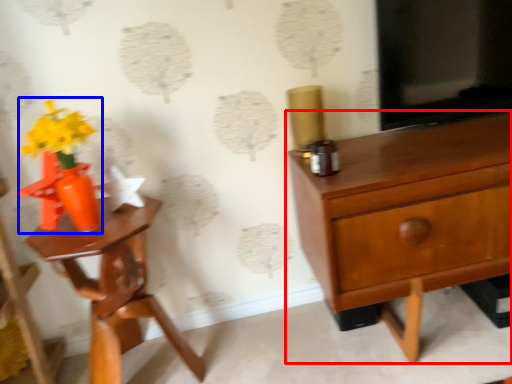
Question: Which object is further to the camera taking this photo, chest of drawers (highlighted by a red box) or floral arrangement (highlighted by a blue box)?

Choices:
 (A) chest of drawers
 (B) floral arrangement

Answer: (B)